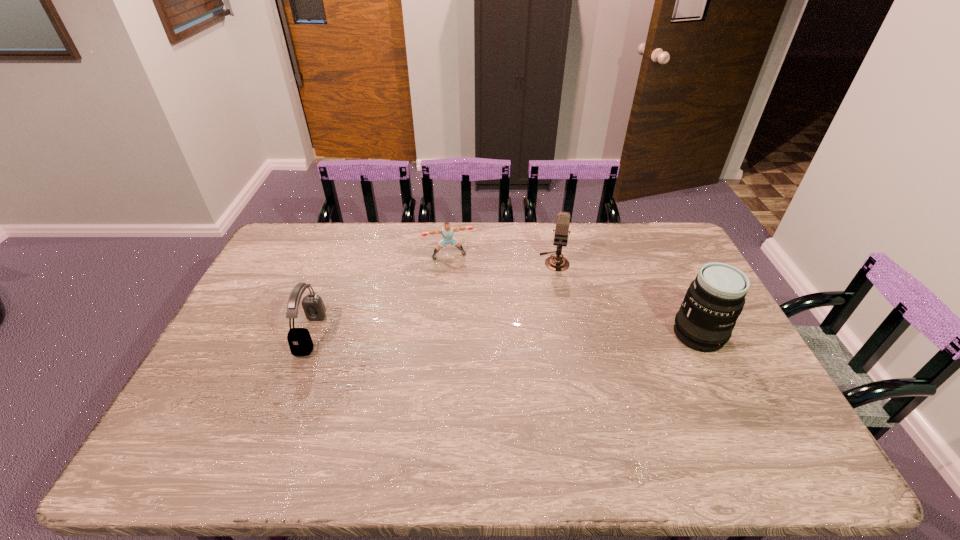
The height and width of the screenshot is (540, 960). Find the location of `the leftmost object`. the leftmost object is located at coordinates (300, 342).

Find the location of `the third tallest object`. the third tallest object is located at coordinates (300, 342).

This screenshot has height=540, width=960. What are the coordinates of `the rightmost object` in the screenshot? It's located at (713, 302).

Identify the location of microphone. [556, 263].

The image size is (960, 540). What are the coordinates of `the second object from left to right` in the screenshot? It's located at (447, 231).

You are a GUI agent. You are given a task and a screenshot of the screen. Output one action in this format:
    pyautogui.click(x=<x>, y=<y>)
    Task: Click on the shortest object
    
    Given the screenshot: What is the action you would take?
    pyautogui.click(x=447, y=231)

In order to click on free space located on the headband of the headset in this screenshot , I will do `click(248, 334)`.

Locate an element on the screen. The height and width of the screenshot is (540, 960). free space located on the headband of the headset is located at coordinates (230, 334).

Locate an element on the screen. Image resolution: width=960 pixels, height=540 pixels. free region located on the headband of the headset is located at coordinates (234, 334).

Identify the location of vacant space located 0.070m on the back of the telephoto lens. This screenshot has width=960, height=540. (682, 300).